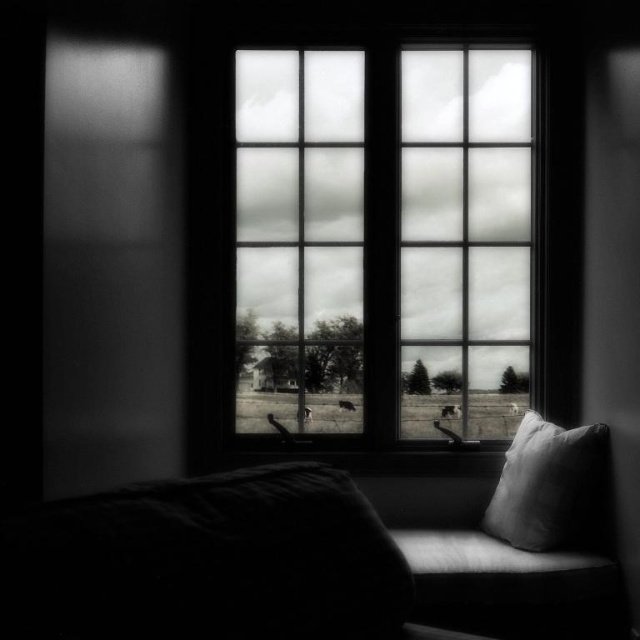
Consider the image. Who is higher up, dark fabric at lower left or white soft pillow at lower right?

dark fabric at lower left

Between dark fabric at lower left and white soft pillow at lower right, which one appears on the left side from the viewer's perspective?

dark fabric at lower left is more to the left.

What are the coordinates of `dark fabric at lower left` in the screenshot? It's located at pos(205,561).

Which is below, clear glass window at center or dark fabric at lower left?

dark fabric at lower left is below.

Does clear glass window at center appear on the left side of dark fabric at lower left?

In fact, clear glass window at center is to the right of dark fabric at lower left.

Which is behind, point (364, 106) or point (259, 502)?

Positioned behind is point (364, 106).

Image resolution: width=640 pixels, height=640 pixels. What are the coordinates of `clear glass window at center` in the screenshot? It's located at (385, 237).

Can you confirm if clear glass window at center is positioned below white soft pillow at lower right?

No.

Does point (337, 148) lie behind point (576, 486)?

Yes, it is.

Between point (390, 273) and point (496, 538), which one is positioned behind?

Positioned behind is point (390, 273).

Locate an element on the screen. clear glass window at center is located at coordinates (385, 237).